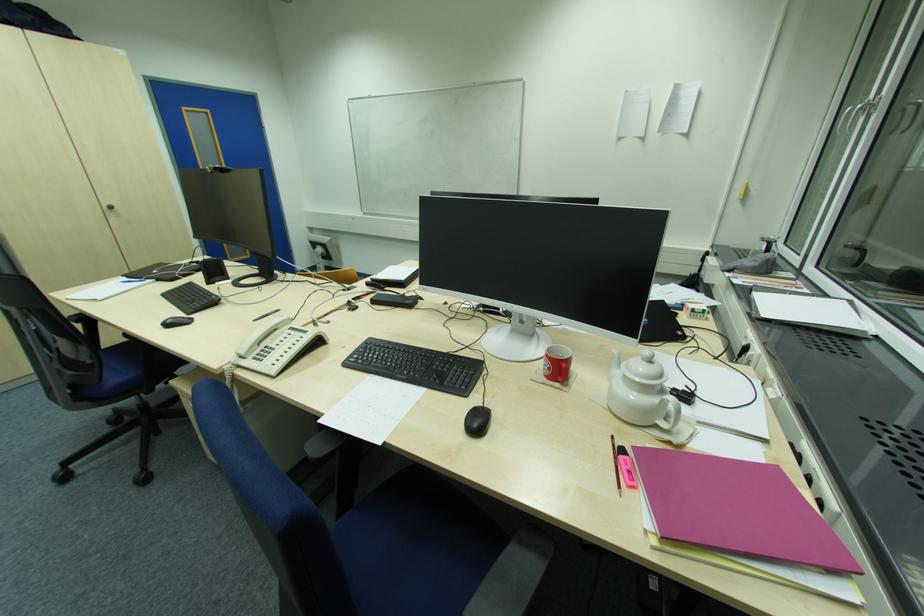
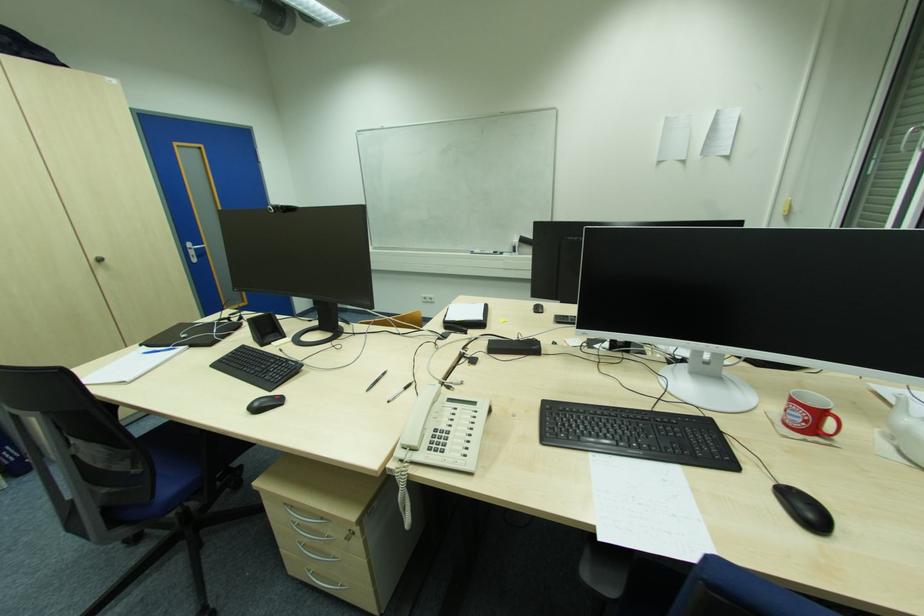
Question: How did the camera likely rotate?

Choices:
 (A) Left
 (B) Right
 (C) Up
 (D) Down

Answer: (B)